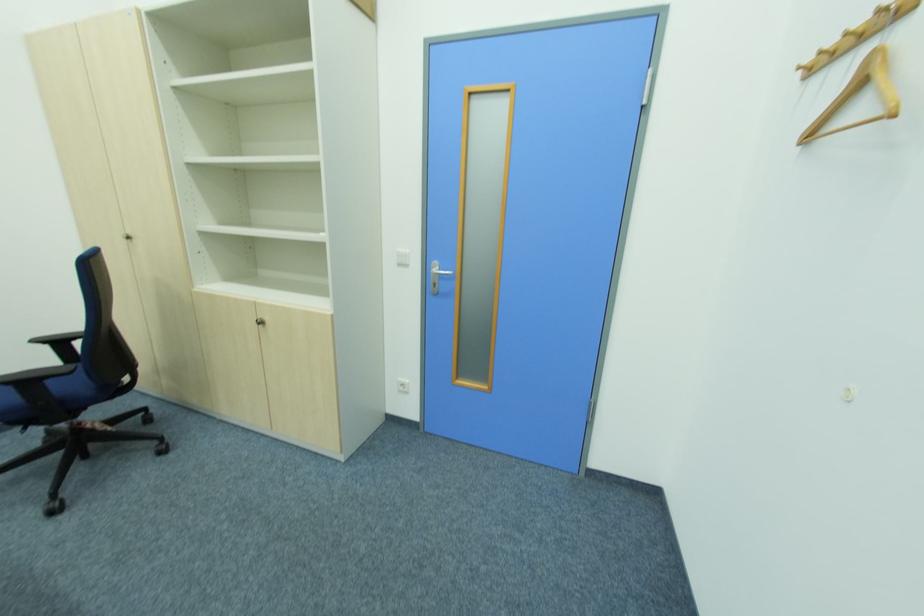
Locate an element on the screen. The width and height of the screenshot is (924, 616). wooden clothes hanger is located at coordinates (858, 70).